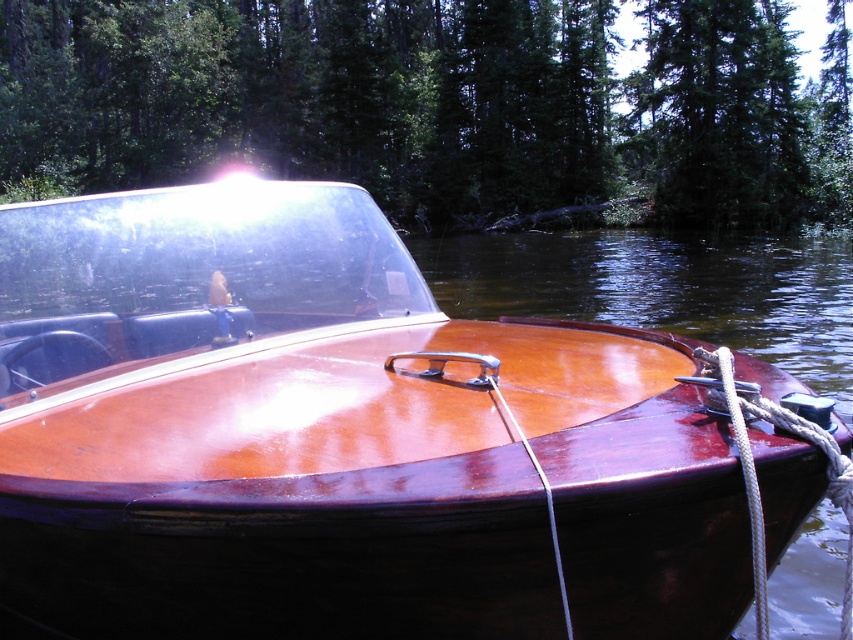
Which is below, glossy wood boat at center or green matte tree at upper center?

glossy wood boat at center is below.

Which is behind, point (515, 339) or point (173, 138)?

The point (173, 138) is more distant.

Where is `glossy wood boat at center`? glossy wood boat at center is located at coordinates (334, 436).